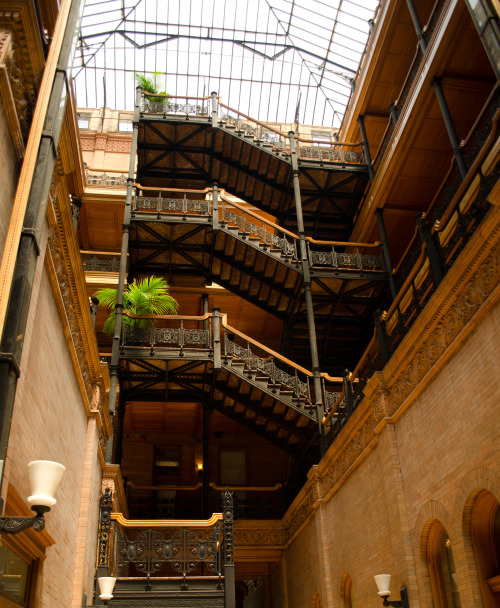
Where is `glass`? Image resolution: width=500 pixels, height=608 pixels. glass is located at coordinates (168, 60).